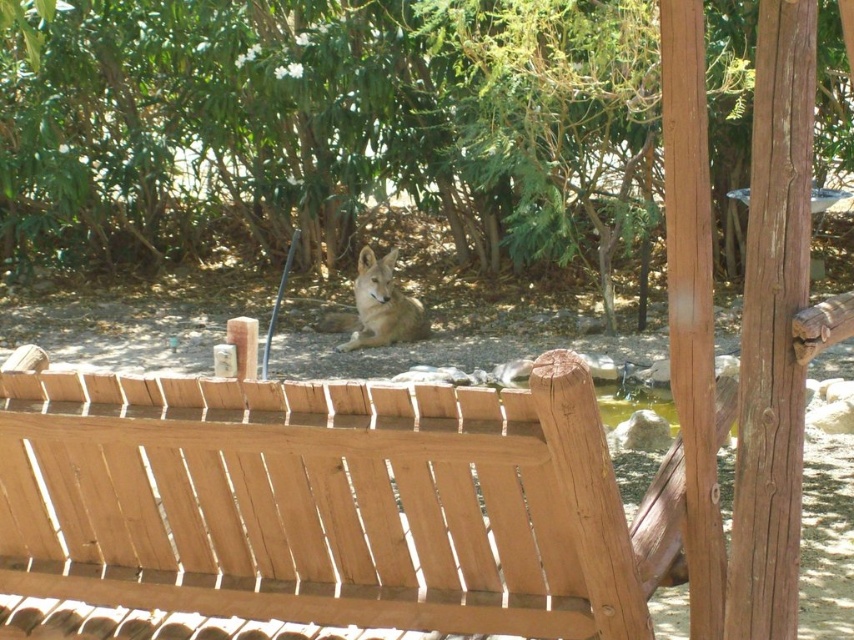
You are sitting on the light brown wood bench at lower center and want to reach the green leafy tree at center. Is the tree above or below you?

The green leafy tree at center is positioned over the light brown wood bench at lower center, so the tree is above you.